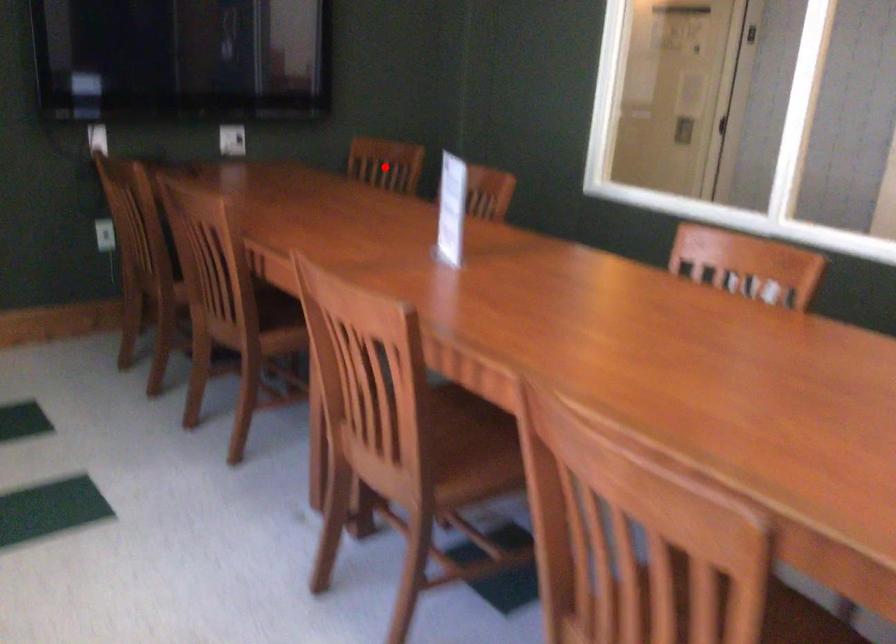
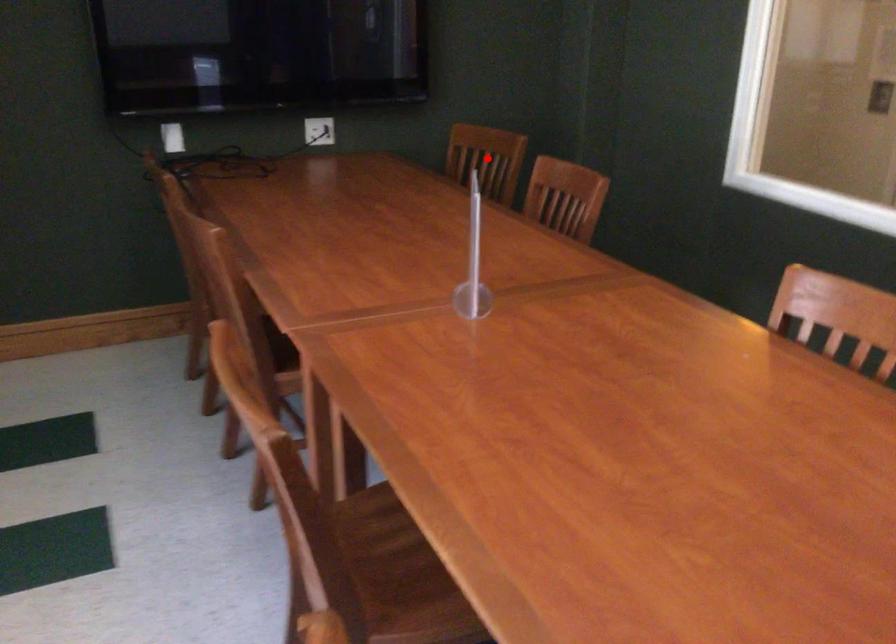
Consider the image. I am providing you with two images of the same scene from different viewpoints. A red point is marked on the first image and another point is marked on the second image. Is the red point in image1 aligned with the point shown in image2?

Yes